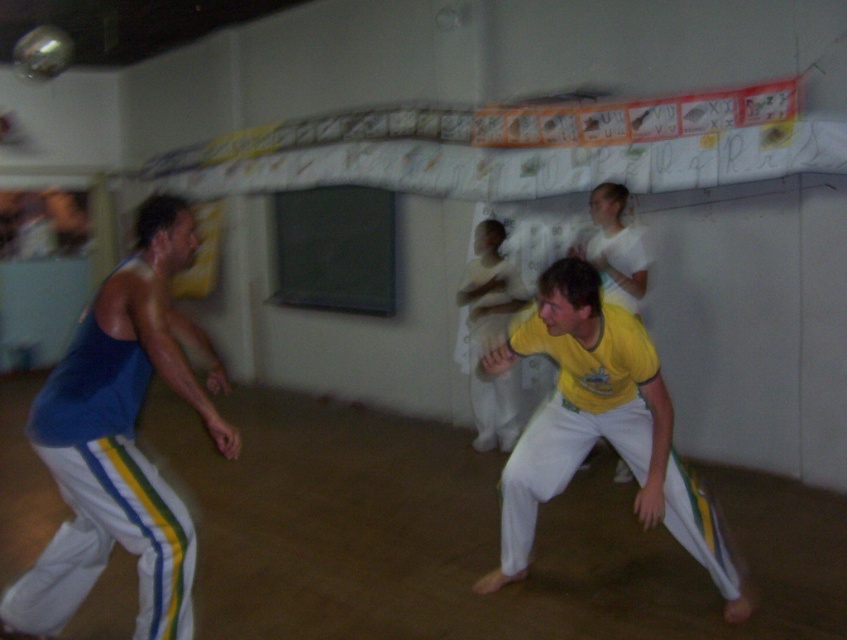
Question: Observing the image, what is the correct spatial positioning of blue fabric pants at left in reference to yellow matte/yellowish-green material pants at center?

Choices:
 (A) right
 (B) left

Answer: (B)

Question: Does blue fabric pants at left appear under yellow matte/yellowish-green material pants at center?

Choices:
 (A) no
 (B) yes

Answer: (B)

Question: Which object appears closest to the camera in this image?

Choices:
 (A) blue fabric pants at left
 (B) yellow matte/yellowish-green material pants at center

Answer: (A)

Question: Which object appears farthest from the camera in this image?

Choices:
 (A) blue fabric pants at left
 (B) yellow matte/yellowish-green material pants at center

Answer: (B)

Question: In this image, where is blue fabric pants at left located relative to yellow matte/yellowish-green material pants at center?

Choices:
 (A) right
 (B) left

Answer: (B)